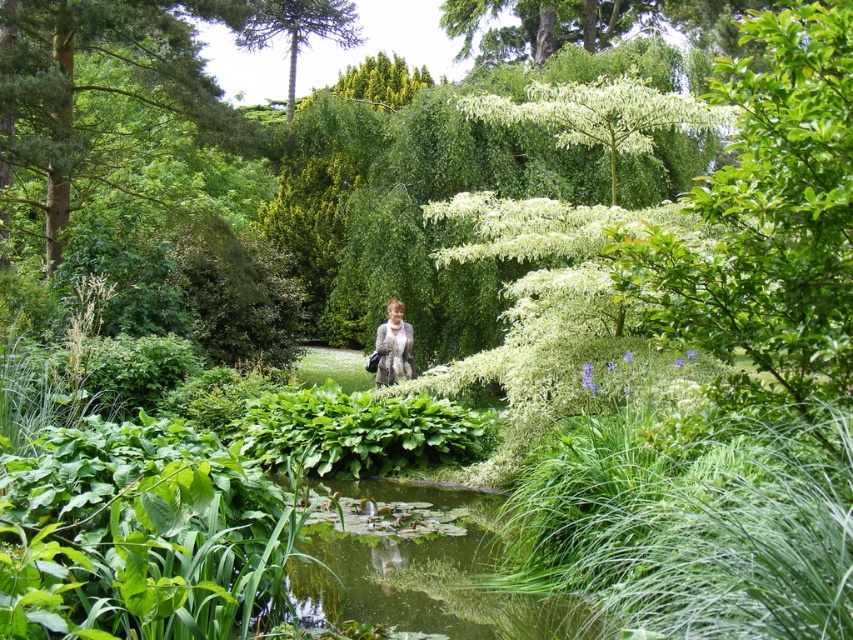
Question: Which point is farther to the camera?

Choices:
 (A) light gray fur coat at center
 (B) green mossy pond at center

Answer: (A)

Question: Is green mossy pond at center closer to camera compared to light gray fur coat at center?

Choices:
 (A) no
 (B) yes

Answer: (B)

Question: Which of the following is the farthest from the observer?

Choices:
 (A) light gray fur coat at center
 (B) green mossy pond at center

Answer: (A)

Question: Where is green mossy pond at center located in relation to light gray fur coat at center in the image?

Choices:
 (A) left
 (B) right

Answer: (B)

Question: In this image, where is green mossy pond at center located relative to light gray fur coat at center?

Choices:
 (A) right
 (B) left

Answer: (A)

Question: Which point is closer to the camera?

Choices:
 (A) light gray fur coat at center
 (B) green mossy pond at center

Answer: (B)